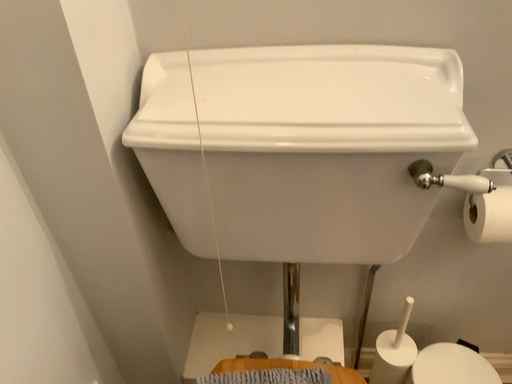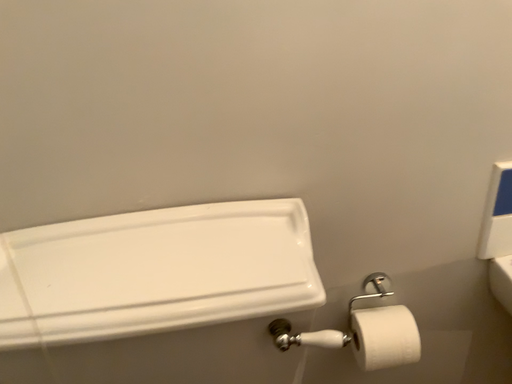
Question: How did the camera likely rotate when shooting the video?

Choices:
 (A) rotated downward
 (B) rotated upward

Answer: (B)